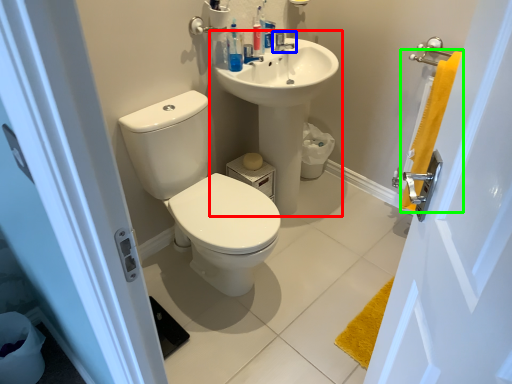
Question: Which object is positioned farthest from sink (highlighted by a red box)? Select from tap (highlighted by a blue box) and bath towel (highlighted by a green box).

Choices:
 (A) tap
 (B) bath towel

Answer: (B)